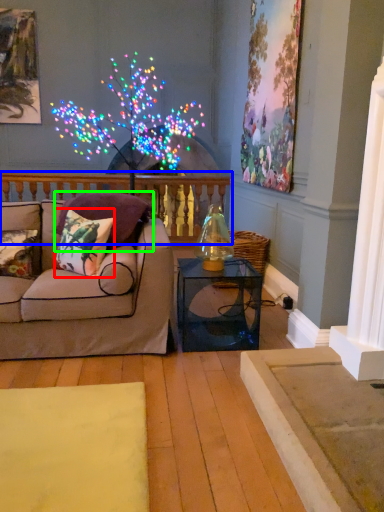
Question: Which object is positioned closest to pillow (highlighted by a red box)? Select from balustrade (highlighted by a blue box) and pillow (highlighted by a green box).

Choices:
 (A) balustrade
 (B) pillow

Answer: (B)